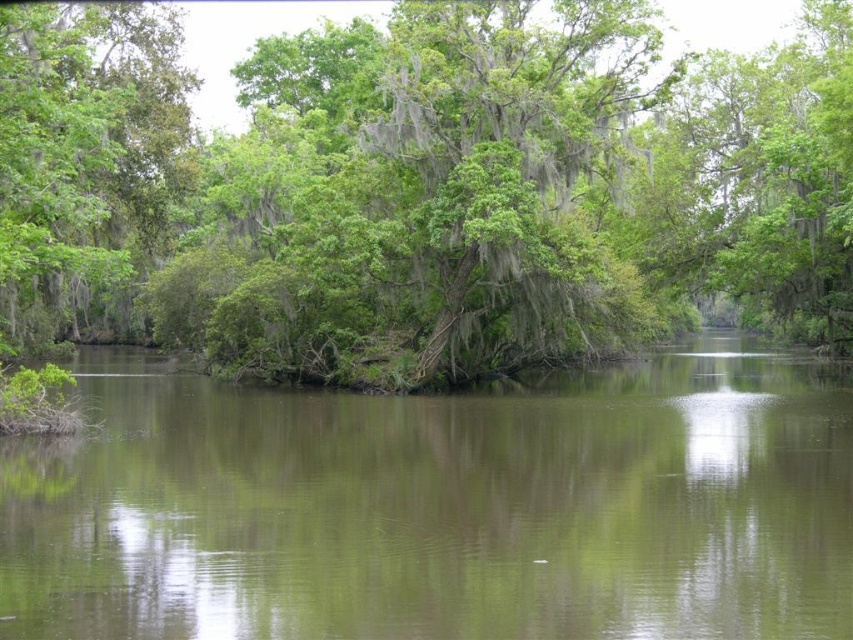
Question: Which point appears closest to the camera in this image?

Choices:
 (A) (44, 72)
 (B) (830, 548)

Answer: (B)

Question: From the image, what is the correct spatial relationship of green leafy tree at center in relation to green reflective water at center?

Choices:
 (A) above
 (B) below

Answer: (A)

Question: Can you confirm if green leafy tree at center is positioned to the right of green reflective water at center?

Choices:
 (A) no
 (B) yes

Answer: (A)

Question: Where is green leafy tree at center located in relation to green reflective water at center in the image?

Choices:
 (A) below
 (B) above

Answer: (B)

Question: Among these points, which one is nearest to the camera?

Choices:
 (A) (614, 65)
 (B) (263, 451)

Answer: (B)